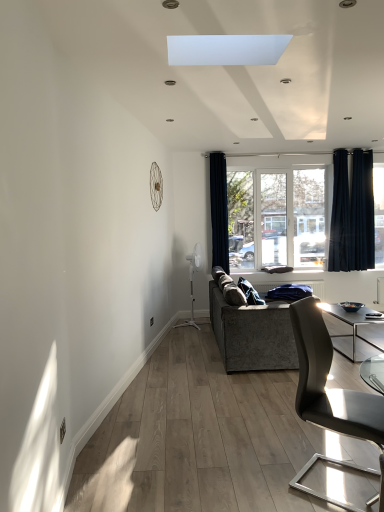
The height and width of the screenshot is (512, 384). I want to click on vacant space to the left of matte black chair at lower right, so click(259, 474).